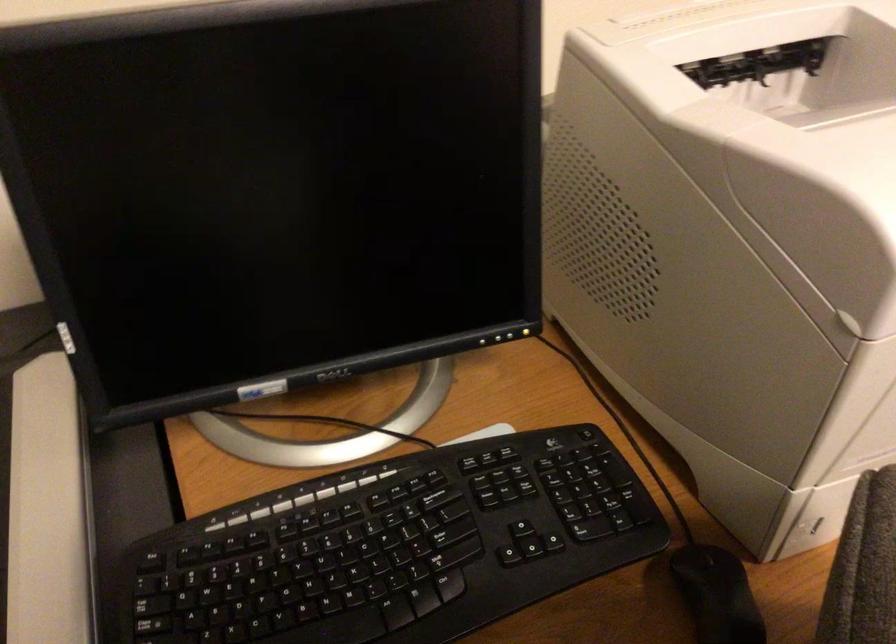
Where would you press the monitor power button? Please return your answer as a coordinate pair (x, y).

(502, 334)